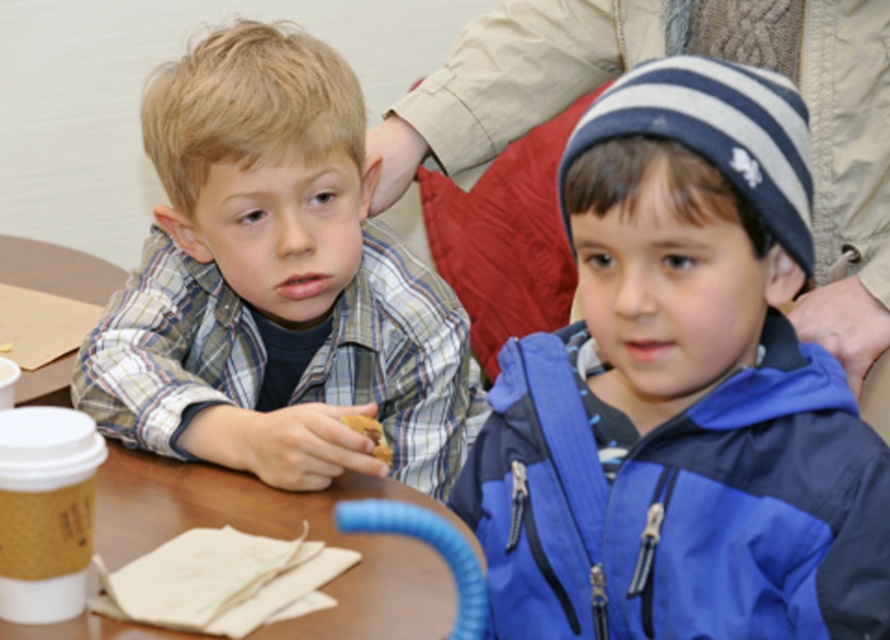
You are a photographer setting up a shot of the two boys. You want to place a small prop between the blue fleece jacket at center and the brown paper cup at left. Based on their positions, where should you position the prop so it is equidistant from both objects?

The blue fleece jacket at center is to the right of the brown paper cup at left, so placing the prop exactly halfway between them would ensure it is equidistant from both objects.

You are a photographer trying to capture a candid shot of both the blue fleece jacket at center and the plaid shirt at left. Based on their positions, which one is closer to the camera?

The plaid shirt at left is closer to the camera because the blue fleece jacket at center is positioned under it, indicating it is behind.

Looking at this image, you are a photographer trying to capture a candid shot of both the blue fleece jacket at center and the plaid shirt at left. Since you can only focus on one subject at a time, which one should you choose to ensure the other is still in the background?

You should focus on the blue fleece jacket at center because it is in front of the plaid shirt at left, so the plaid shirt at left will naturally be in the background if the jacket is in focus.